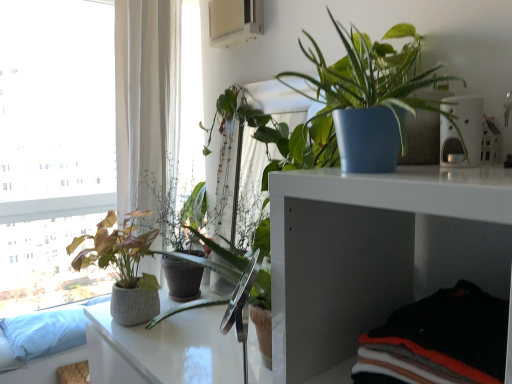
Question: Considering the relative positions of white plastic pet feeder at upper right and white glossy table at center in the image provided, is white plastic pet feeder at upper right in front of white glossy table at center?

Choices:
 (A) no
 (B) yes

Answer: (B)

Question: Does white plastic pet feeder at upper right appear on the left side of white glossy table at center?

Choices:
 (A) yes
 (B) no

Answer: (B)

Question: From a real-world perspective, is white plastic pet feeder at upper right on top of white glossy table at center?

Choices:
 (A) yes
 (B) no

Answer: (A)

Question: From a real-world perspective, is white plastic pet feeder at upper right physically below white glossy table at center?

Choices:
 (A) yes
 (B) no

Answer: (B)

Question: Does white plastic pet feeder at upper right turn towards white glossy table at center?

Choices:
 (A) yes
 (B) no

Answer: (B)

Question: Does white plastic pet feeder at upper right have a larger size compared to white glossy table at center?

Choices:
 (A) yes
 (B) no

Answer: (B)

Question: Is white glossy table at center thinner than white plastic pet feeder at upper right?

Choices:
 (A) no
 (B) yes

Answer: (A)

Question: From the image's perspective, is white glossy table at center on white plastic pet feeder at upper right?

Choices:
 (A) no
 (B) yes

Answer: (A)

Question: Does white glossy table at center come behind white plastic pet feeder at upper right?

Choices:
 (A) yes
 (B) no

Answer: (A)

Question: From a real-world perspective, is white glossy table at center positioned over white plastic pet feeder at upper right based on gravity?

Choices:
 (A) yes
 (B) no

Answer: (B)

Question: From a real-world perspective, is white glossy table at center positioned under white plastic pet feeder at upper right based on gravity?

Choices:
 (A) no
 (B) yes

Answer: (B)

Question: From the image's perspective, is white glossy table at center under white plastic pet feeder at upper right?

Choices:
 (A) no
 (B) yes

Answer: (B)

Question: From the image's perspective, does blue fabric couch at lower left appear lower than textured gray pot at left, marked as the second houseplant in a top-to-bottom arrangement?

Choices:
 (A) no
 (B) yes

Answer: (B)